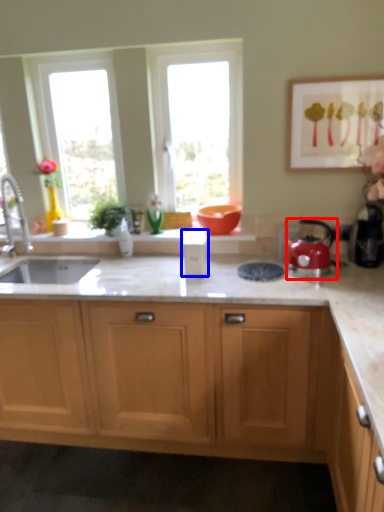
Question: Which point is closer to the camera, kettle (highlighted by a red box) or appliance (highlighted by a blue box)?

Choices:
 (A) kettle
 (B) appliance

Answer: (A)